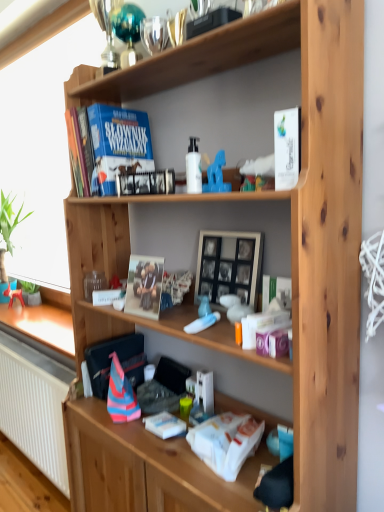
Question: Does white glossy bottle at center contain white glossy paperback book at upper right, positioned as the first paperback book in right-to-left order?

Choices:
 (A) no
 (B) yes

Answer: (A)

Question: From the image's perspective, does white glossy bottle at center appear higher than white glossy paperback book at upper right, arranged as the second paperback book when ordered from the bottom?

Choices:
 (A) no
 (B) yes

Answer: (B)

Question: Is white glossy bottle at center to the right of white glossy paperback book at upper right, arranged as the second paperback book when ordered from the bottom, from the viewer's perspective?

Choices:
 (A) yes
 (B) no

Answer: (B)

Question: Is the depth of white glossy bottle at center greater than that of white glossy paperback book at upper right, arranged as the second paperback book when ordered from the bottom?

Choices:
 (A) no
 (B) yes

Answer: (B)

Question: Is white glossy bottle at center in contact with white glossy paperback book at upper right, positioned as the first paperback book in right-to-left order?

Choices:
 (A) no
 (B) yes

Answer: (A)

Question: Would you say matte cardboard photo frame at center, which is the 2th paperback book from back to front, is to the left or to the right of white glossy paperback book at upper right, positioned as the first paperback book in right-to-left order, in the picture?

Choices:
 (A) left
 (B) right

Answer: (A)

Question: Considering the positions of point (135, 258) and point (294, 178), is point (135, 258) closer or farther from the camera than point (294, 178)?

Choices:
 (A) closer
 (B) farther

Answer: (B)

Question: Relative to white glossy paperback book at upper right, placed as the first paperback book when sorted from front to back, is matte cardboard photo frame at center, the second paperback book from the left, in front or behind?

Choices:
 (A) behind
 (B) front

Answer: (A)

Question: From a real-world perspective, relative to white glossy paperback book at upper right, placed as the third paperback book when sorted from back to front, is matte cardboard photo frame at center, which is the 2th paperback book from back to front, vertically above or below?

Choices:
 (A) above
 (B) below

Answer: (B)

Question: Would you say white glossy paperback book at upper right, arranged as the second paperback book when ordered from the bottom, is to the left or to the right of hardcover book at upper center, which is the 1th paperback book in top-to-bottom order, in the picture?

Choices:
 (A) right
 (B) left

Answer: (A)

Question: Considering the positions of white glossy paperback book at upper right, arranged as the second paperback book when ordered from the bottom, and hardcover book at upper center, which is the 3th paperback book in front-to-back order, in the image, is white glossy paperback book at upper right, arranged as the second paperback book when ordered from the bottom, taller or shorter than hardcover book at upper center, which is the 3th paperback book in front-to-back order,?

Choices:
 (A) short
 (B) tall

Answer: (A)

Question: Relative to hardcover book at upper center, acting as the third paperback book starting from the bottom, is white glossy paperback book at upper right, the second paperback book in the top-to-bottom sequence, in front or behind?

Choices:
 (A) behind
 (B) front

Answer: (B)

Question: Does point (284, 185) appear closer or farther from the camera than point (107, 140)?

Choices:
 (A) farther
 (B) closer

Answer: (B)

Question: Is green matte plant at lower left bigger or smaller than matte cardboard photo frame at center, the second paperback book positioned from the front?

Choices:
 (A) small
 (B) big

Answer: (A)

Question: In the image, is green matte plant at lower left on the left side or the right side of matte cardboard photo frame at center, the first paperback book from the bottom?

Choices:
 (A) right
 (B) left

Answer: (B)